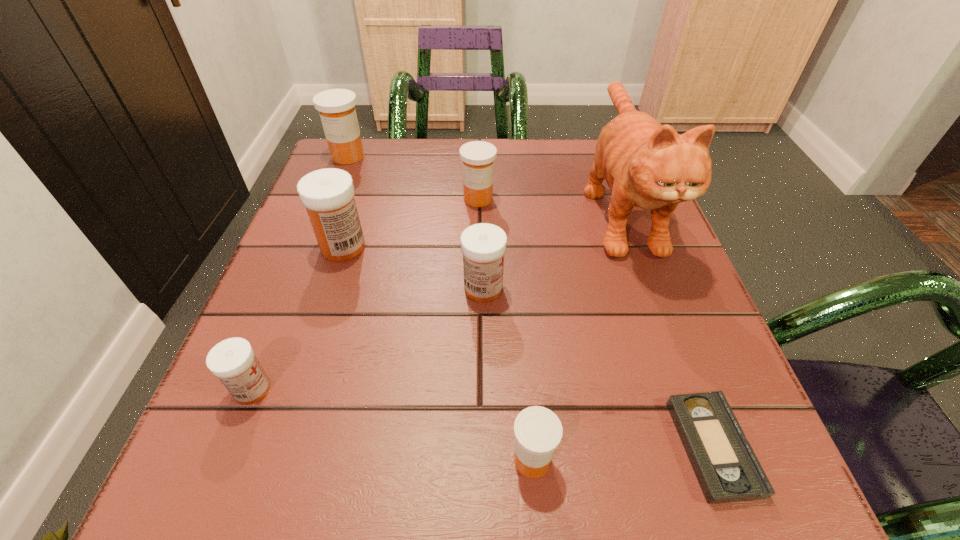
Locate an element on the screen. The image size is (960, 540). object that is at the far left corner is located at coordinates (336, 107).

Where is `object positioned at the far right corner`? The image size is (960, 540). object positioned at the far right corner is located at coordinates (647, 165).

Image resolution: width=960 pixels, height=540 pixels. I want to click on object positioned at the near right corner, so click(x=727, y=469).

Where is `vacant region at the far edge of the desktop`? The width and height of the screenshot is (960, 540). vacant region at the far edge of the desktop is located at coordinates (430, 187).

The width and height of the screenshot is (960, 540). I want to click on vacant space at the near edge of the desktop, so click(x=543, y=501).

The height and width of the screenshot is (540, 960). I want to click on free space at the left edge of the desktop, so click(x=282, y=355).

Where is `free region at the right edge of the desktop`? This screenshot has height=540, width=960. free region at the right edge of the desktop is located at coordinates [x=673, y=274].

Locate an element on the screen. This screenshot has height=540, width=960. vacant space at the far left corner of the desktop is located at coordinates (375, 180).

Find the location of a particular element. This screenshot has width=960, height=540. free space between the second farthest orange medicine and the fifth farthest medicine is located at coordinates click(366, 294).

Locate an element on the screen. vacant space in between the videotape and the second farthest orange medicine is located at coordinates (595, 323).